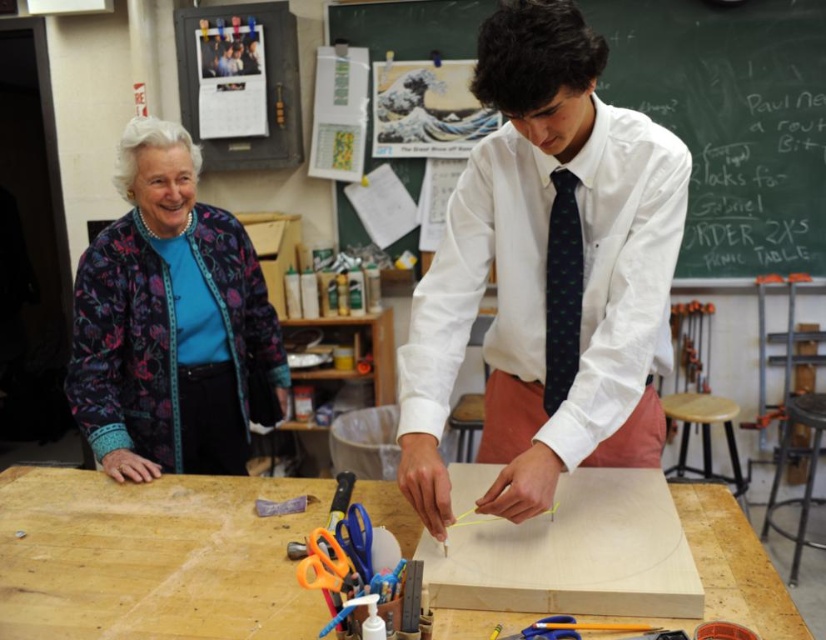
Question: From the image, what is the correct spatial relationship of floral-patterned fabric at left in relation to metallic stool at lower right?

Choices:
 (A) right
 (B) left

Answer: (B)

Question: Does white smooth shirt at center appear on the right side of green chalkboard at upper center?

Choices:
 (A) yes
 (B) no

Answer: (B)

Question: Observing the image, what is the correct spatial positioning of green chalkboard at upper center in reference to dark green textured tie at center?

Choices:
 (A) below
 (B) above

Answer: (B)

Question: Based on their relative distances, which object is nearer to the dark green textured tie at center?

Choices:
 (A) green chalkboard at upper center
 (B) floral-patterned fabric at left
 (C) wooden stool at right

Answer: (B)

Question: Which point is closer to the camera?

Choices:
 (A) (746, 67)
 (B) (771, 621)

Answer: (B)

Question: Which is nearer to the green chalkboard at upper center?

Choices:
 (A) white smooth shirt at center
 (B) metallic stool at lower right
 (C) dark green textured tie at center
 (D) light brown wood at center

Answer: (B)